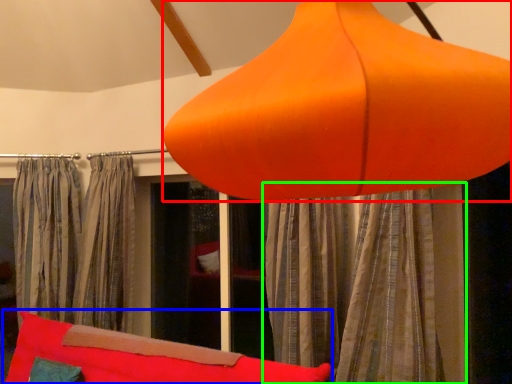
Question: Considering the real-world distances, which object is closest to lamp (highlighted by a red box)? bean bag chair (highlighted by a blue box) or curtain (highlighted by a green box).

Choices:
 (A) bean bag chair
 (B) curtain

Answer: (B)